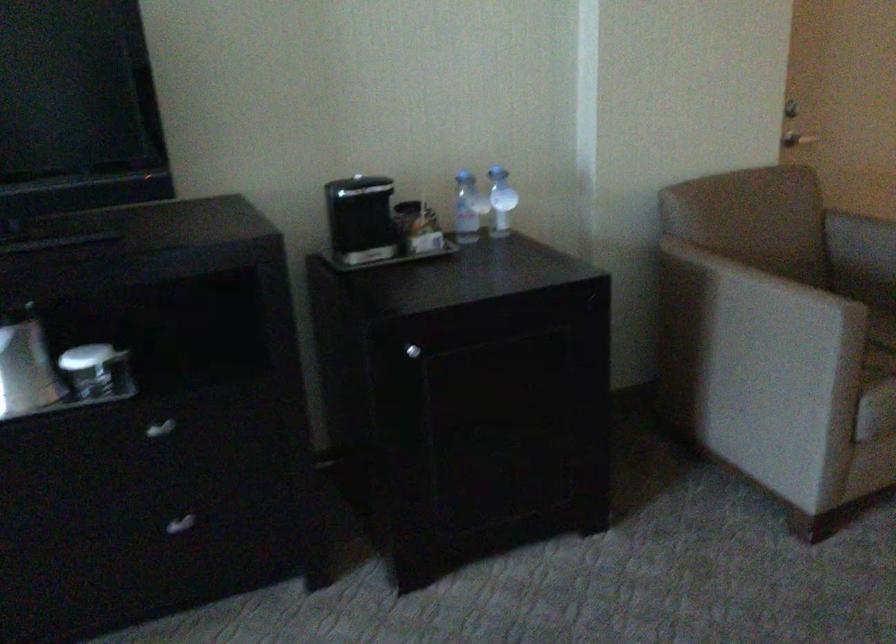
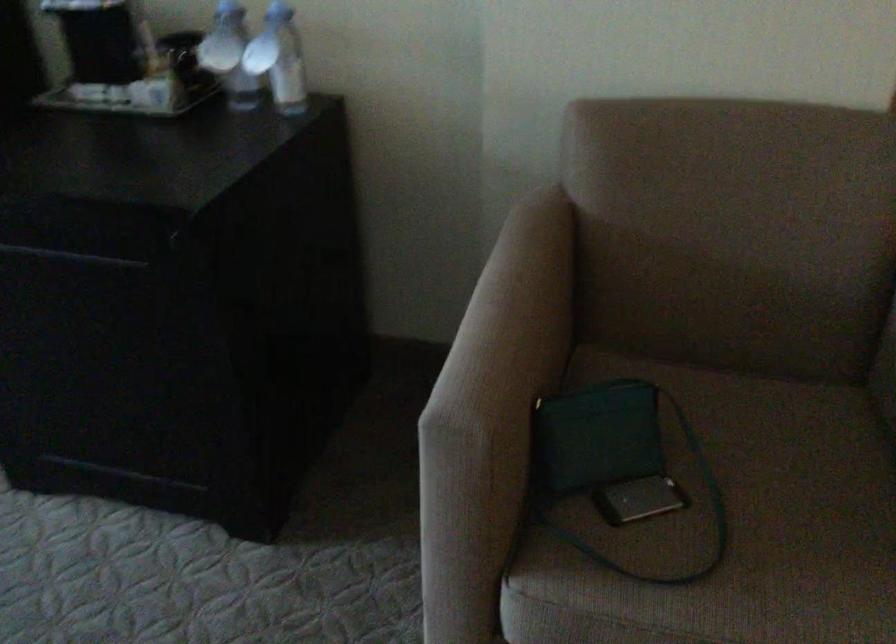
The point at (477, 204) is marked in the first image. Where is the corresponding point in the second image?

(229, 55)